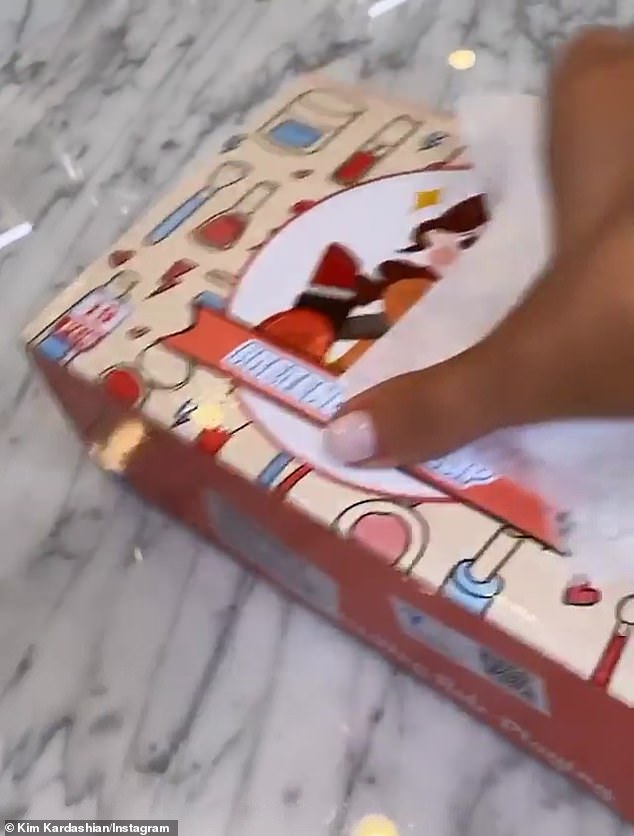
This screenshot has width=634, height=836. Find the location of `countertop`. countertop is located at coordinates (209, 742).